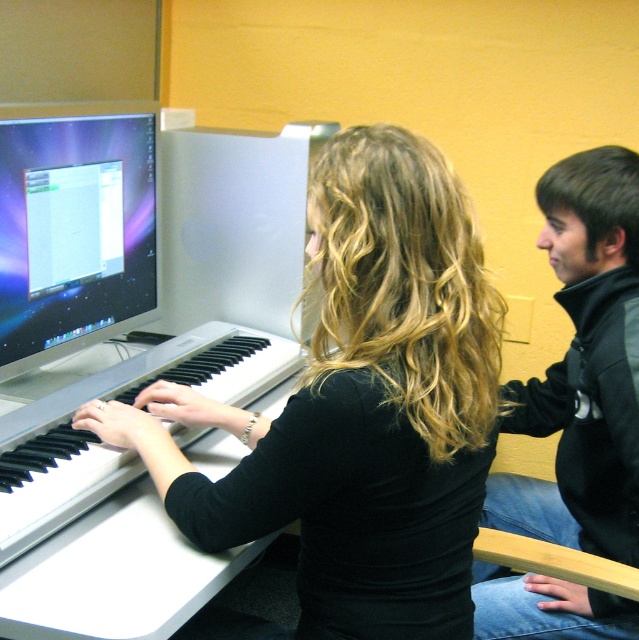
You are a music teacher observing two instruments in front of you. You have a student who needs to play the black matte keyboard at center and the black plastic piano at center. Which instrument should the student approach first if they want to start with the one on the left?

The student should approach the black plastic piano at center first because the black matte keyboard at center is positioned on the right side of it.

Consider the image. You are a delivery person who needs to place a new monitor that is 30 centimeters wide onto the desk. The shiny silver monitor at left and the black plastic piano at center are already on the desk. Can you fit the new monitor between them?

The distance between the shiny silver monitor at left and the black plastic piano at center is 29.63 centimeters. Since the new monitor is 30 centimeters wide, it would not fit in the space between them as the available space is slightly smaller than the monitor.